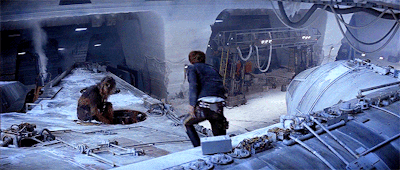
Where is `ladder`? The height and width of the screenshot is (170, 400). ladder is located at coordinates (222, 69).